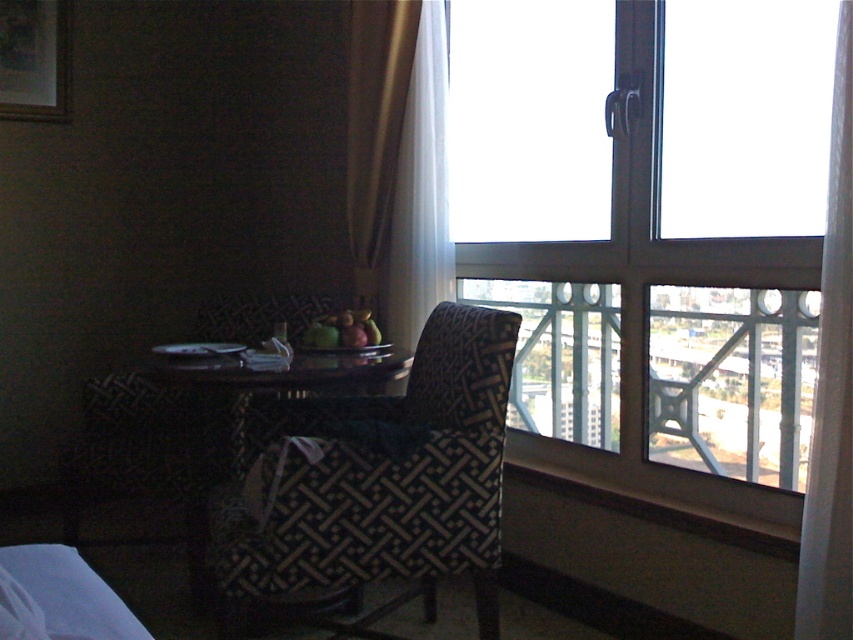
You are standing at the entrance of the room and want to sit in the patterned fabric armchair at center. Which direction should you walk to reach it?

Since the patterned fabric armchair at center is located at point (x=374, y=483), you should walk towards the center of the room to reach it.